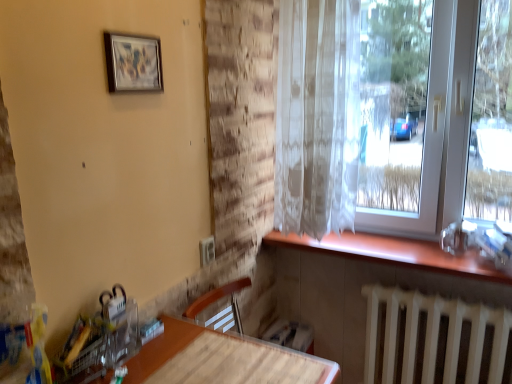
This screenshot has height=384, width=512. I want to click on free point above wooden table at lower center (from a real-world perspective), so click(x=225, y=363).